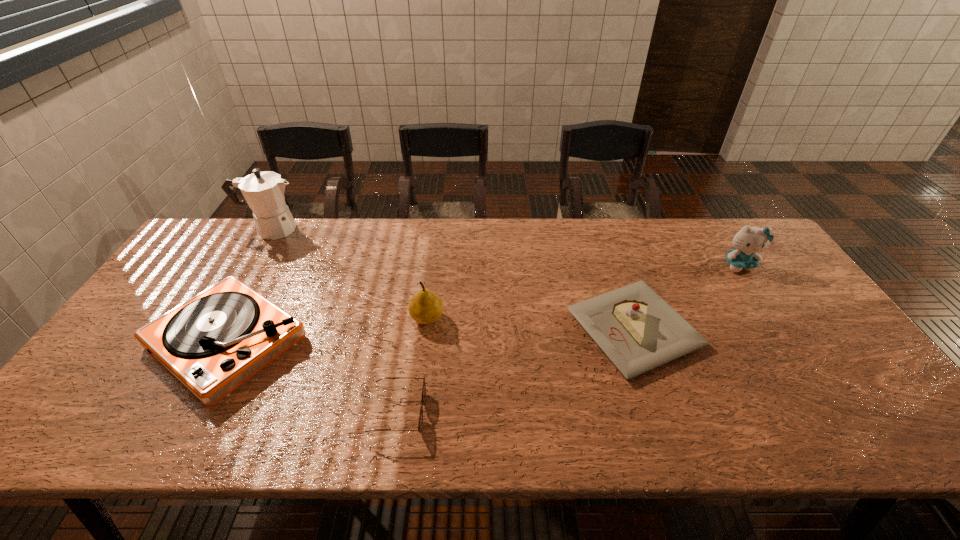
Locate which object is the fifth closest to the shortest object. Please provide its 2D coordinates. Your answer should be formatted as a tuple, i.e. [(x, y)], where the tuple contains the x and y coordinates of a point satisfying the conditions above.

[(748, 241)]

What are the coordinates of `vacant position in the image that satisfies the following two spatial constraints: 1. on the front side of the fifth object from left to right; 2. on the right side of the pear` in the screenshot? It's located at (426, 329).

Where is `vacant point that satisfies the following two spatial constraints: 1. on the front side of the second object from right to left; 2. on the left side of the pear`? The height and width of the screenshot is (540, 960). vacant point that satisfies the following two spatial constraints: 1. on the front side of the second object from right to left; 2. on the left side of the pear is located at coordinates (426, 329).

At what (x,y) coordinates should I click in order to perform the action: click on vacant space that satisfies the following two spatial constraints: 1. on the back side of the record player; 2. on the left side of the pear. Please return your answer as a coordinate pair (x, y). Looking at the image, I should click on (240, 318).